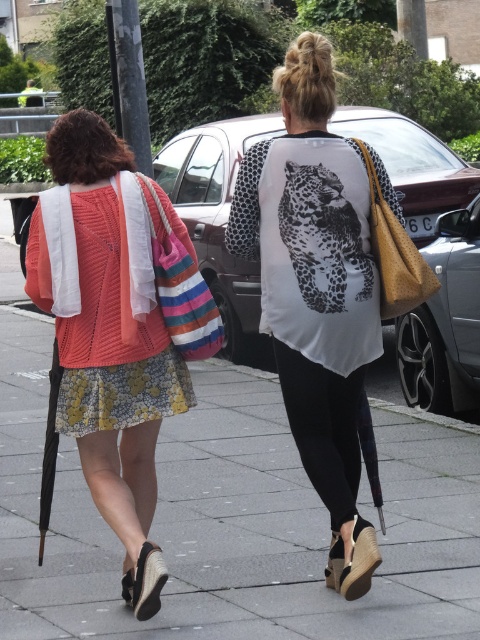
Can you confirm if metallic silver car at center is smaller than shiny black car at right?

Incorrect, metallic silver car at center is not smaller in size than shiny black car at right.

Does metallic silver car at center lie behind shiny black car at right?

Yes, metallic silver car at center is further from the viewer.

Describe the element at coordinates (217, 214) in the screenshot. I see `metallic silver car at center` at that location.

What are the coordinates of `metallic silver car at center` in the screenshot? It's located at (217, 214).

Is metallic silver car at center bigger than printed cotton dress at center?

Yes.

Where is `metallic silver car at center`? This screenshot has width=480, height=640. metallic silver car at center is located at coordinates (217, 214).

Does knitted cotton sweater at left appear over shiny black car at right?

Incorrect, knitted cotton sweater at left is not positioned above shiny black car at right.

Measure the distance between knitted cotton sweater at left and camera.

knitted cotton sweater at left and camera are 3.94 meters apart from each other.

Identify the location of knitted cotton sweater at left. (108, 348).